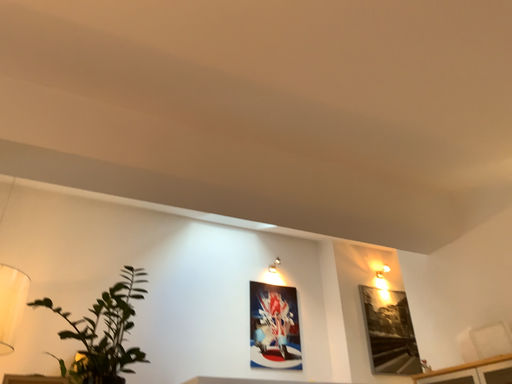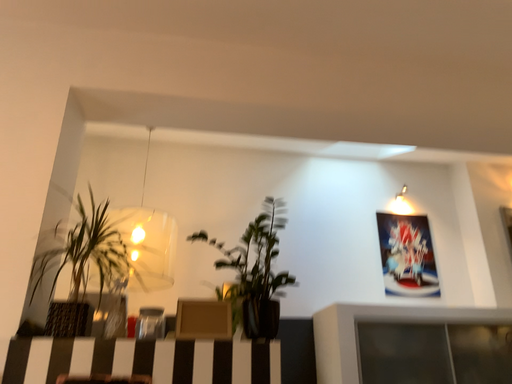
Question: Which way did the camera rotate in the video?

Choices:
 (A) rotated upward
 (B) rotated downward

Answer: (B)